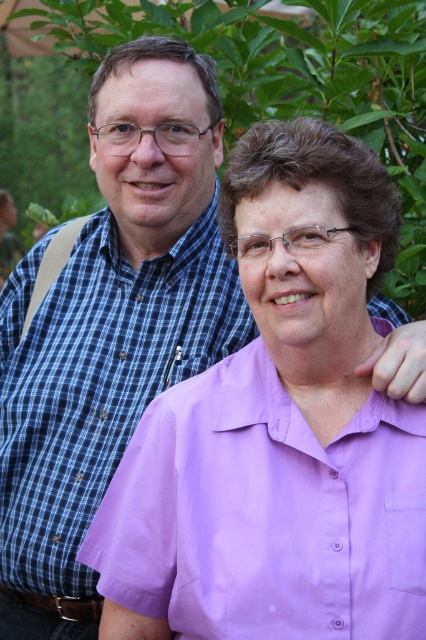
You are a photographer standing 5 feet away from the camera. You want to take a photo of the lavender smooth shirt at center. Can you move closer to the shirt without moving the camera?

The distance between the lavender smooth shirt at center and the camera is 6.48 feet. Since you are currently 5 feet away from the camera, you can move closer to the shirt as long as you stay within the 6.48 feet distance between the shirt and the camera.

You are a photographer trying to capture a closeup of the lavender smooth shirt at center. Given that the camera focuses best within a 0.5 meter radius, can you estimate if the shirt is within the focus range?

The position of lavender smooth shirt at center is at point (x=265, y=515), which is outside the 0.5 meter focus range, so it might be out of focus.

You are a photographer trying to capture both the lavender smooth shirt at center and the purple cotton shirt at center in a single frame. Based on their positions, which shirt will appear closer to the camera in the photo?

The lavender smooth shirt at center will appear closer to the camera because it is positioned in front of the purple cotton shirt at center.